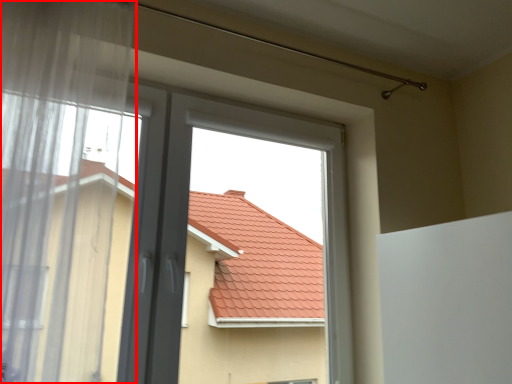
Question: From the image's perspective, where is window (annotated by the red box) located relative to bay window?

Choices:
 (A) below
 (B) above

Answer: (B)